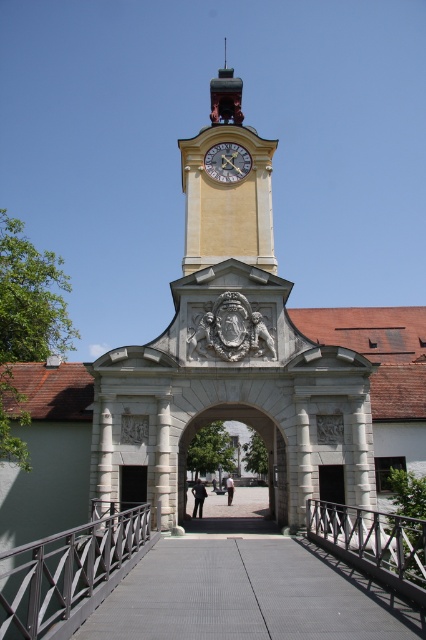
Can you confirm if yellow painted clock tower at upper center is smaller than gold metallic clock at center?

No, yellow painted clock tower at upper center is not smaller than gold metallic clock at center.

Is point (192, 209) in front of point (239, 168)?

Yes, point (192, 209) is in front of point (239, 168).

Is point (252, 243) farther from viewer compared to point (224, 177)?

No, (252, 243) is closer to viewer.

This screenshot has width=426, height=640. I want to click on yellow painted clock tower at upper center, so click(227, 184).

Which is behind, point (236, 637) or point (221, 417)?

Point (221, 417)

Measure the distance between smooth concrete path at center and white stone archway at center.

16.92 meters

Measure the distance between smooth concrete path at center and camera.

A distance of 26.01 meters exists between smooth concrete path at center and camera.

Locate an element on the screen. The width and height of the screenshot is (426, 640). smooth concrete path at center is located at coordinates [x=249, y=595].

Measure the distance between point (207,145) and camera.

Point (207,145) and camera are 70.93 meters apart from each other.

The image size is (426, 640). Identify the location of yellow painted clock tower at upper center. (227, 184).

Identify the location of yellow painted clock tower at upper center. Image resolution: width=426 pixels, height=640 pixels. (227, 184).